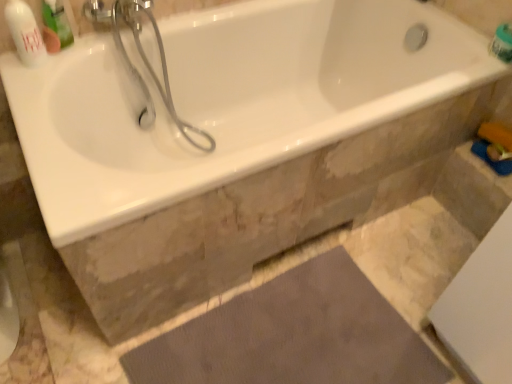
Question: In terms of size, does brown textured mat at lower center appear bigger or smaller than green plastic container at upper right, which is the second toiletry in front-to-back order?

Choices:
 (A) small
 (B) big

Answer: (B)

Question: Is brown textured mat at lower center taller or shorter than green plastic container at upper right, which is the first toiletry from back to front?

Choices:
 (A) short
 (B) tall

Answer: (A)

Question: Which object is positioned farthest from the green plastic container at upper right, which is the first toiletry from back to front?

Choices:
 (A) white glossy bottle at upper left, the first toiletry when ordered from front to back
 (B) white glossy bathtub at upper center
 (C) brown textured mat at lower center
 (D) green plastic mouthwash at upper left
 (E) white glossy shower head at upper left

Answer: (A)

Question: Which object is positioned farthest from the green plastic mouthwash at upper left?

Choices:
 (A) white glossy bottle at upper left, the first toiletry positioned from the left
 (B) white glossy bathtub at upper center
 (C) brown textured mat at lower center
 (D) white glossy shower head at upper left
 (E) green plastic container at upper right, which is the second toiletry in front-to-back order

Answer: (E)